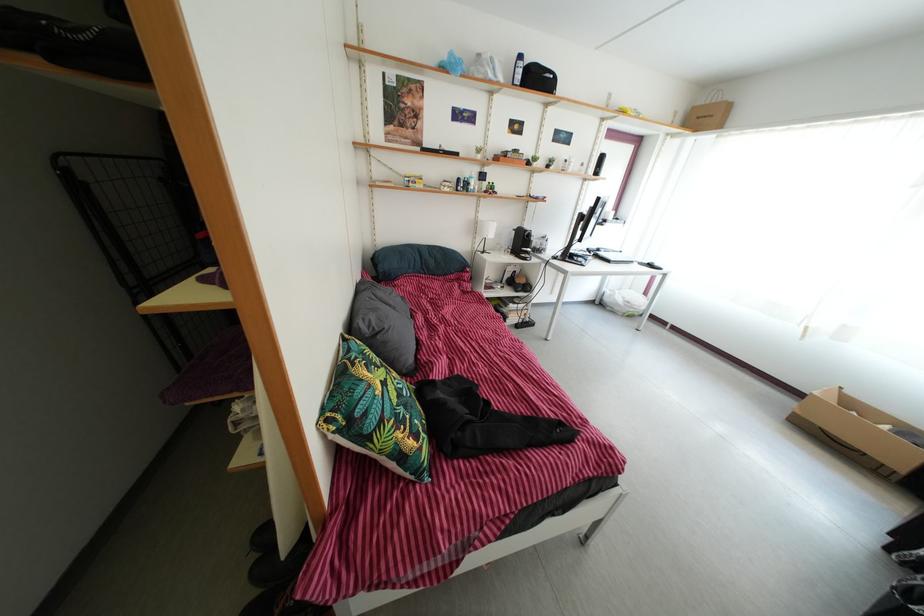
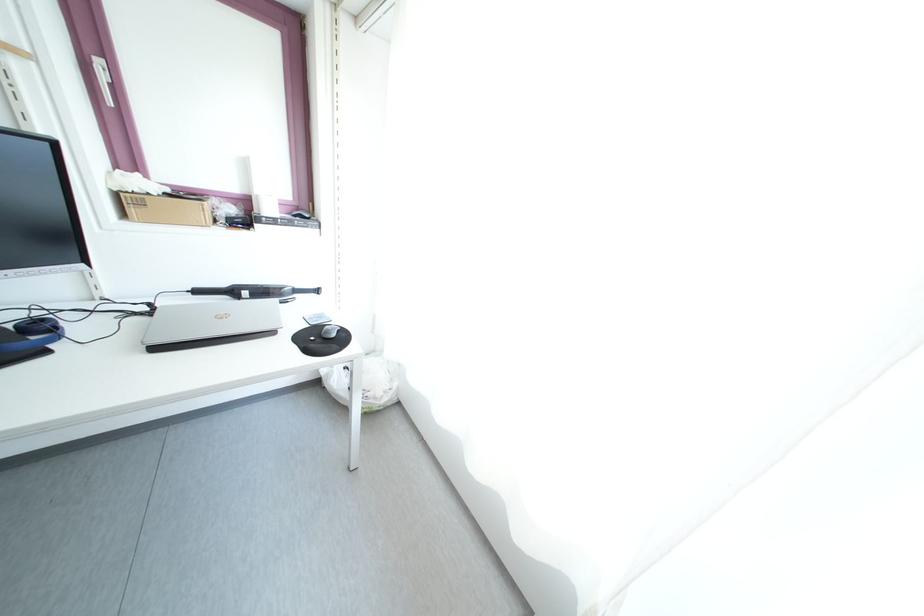
Where in the second image is the point corresponding to point (624, 312) from the first image?

(344, 403)